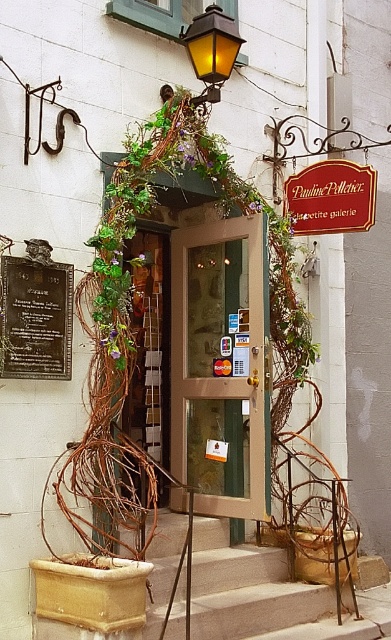
Question: Which of the following is the closest to the observer?

Choices:
 (A) matte yellow glass lamp at upper center
 (B) smooth concrete stairs at center
 (C) transparent glass door at center

Answer: (B)

Question: Which of the following is the farthest from the observer?

Choices:
 (A) transparent glass door at center
 (B) wooden sign at center
 (C) smooth concrete stairs at center
 (D) matte yellow glass lamp at upper center

Answer: (B)

Question: Does transparent glass door at center appear on the left side of wooden sign at center?

Choices:
 (A) yes
 (B) no

Answer: (A)

Question: Which of the following is the closest to the observer?

Choices:
 (A) wooden sign at center
 (B) bronze plaque at center left
 (C) matte yellow glass lamp at upper center

Answer: (B)

Question: Is transparent glass door at center further to the viewer compared to wooden sign at center?

Choices:
 (A) yes
 (B) no

Answer: (B)

Question: Is bronze plaque at center left behind wooden sign at center?

Choices:
 (A) yes
 (B) no

Answer: (B)